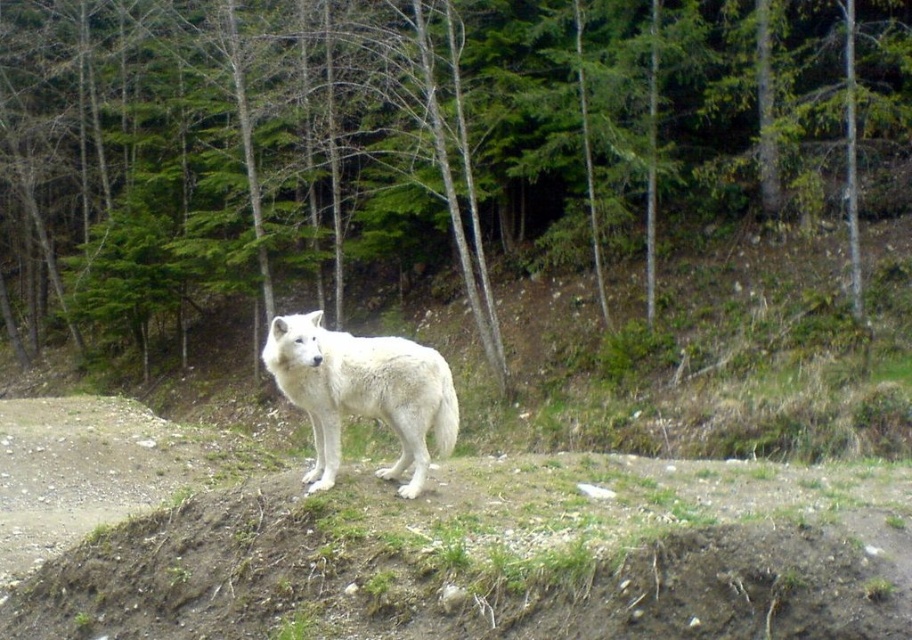
Between green leafy tree at center and white fur wolf at center, which one appears on the left side from the viewer's perspective?

From the viewer's perspective, green leafy tree at center appears more on the left side.

Can you confirm if green leafy tree at center is shorter than white fur wolf at center?

No.

What do you see at coordinates (410, 141) in the screenshot? The width and height of the screenshot is (912, 640). I see `green leafy tree at center` at bounding box center [410, 141].

Identify the location of green leafy tree at center. (410, 141).